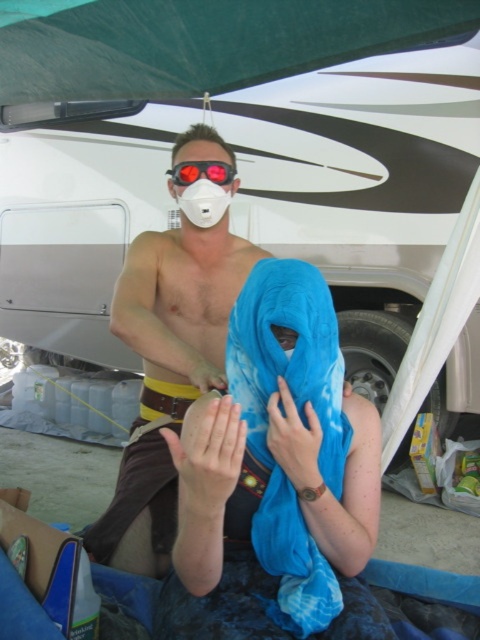
Question: Among these objects, which one is nearest to the camera?

Choices:
 (A) green fabric canopy at upper center
 (B) red reflective lens goggles at center

Answer: (B)

Question: Is blue silk scarf at center smaller than white matte mask at center?

Choices:
 (A) yes
 (B) no

Answer: (B)

Question: Which point is farther to the camera?

Choices:
 (A) (64, 20)
 (B) (228, 413)

Answer: (A)

Question: Among these objects, which one is farthest from the camera?

Choices:
 (A) blue fabric at center
 (B) blue silk scarf at center
 (C) blue fabric hand at center

Answer: (A)

Question: Can you confirm if blue silk scarf at center is positioned below red reflective lens goggles at center?

Choices:
 (A) yes
 (B) no

Answer: (A)

Question: Can you confirm if blue silk scarf at center is positioned to the left of red reflective lens goggles at center?

Choices:
 (A) yes
 (B) no

Answer: (B)